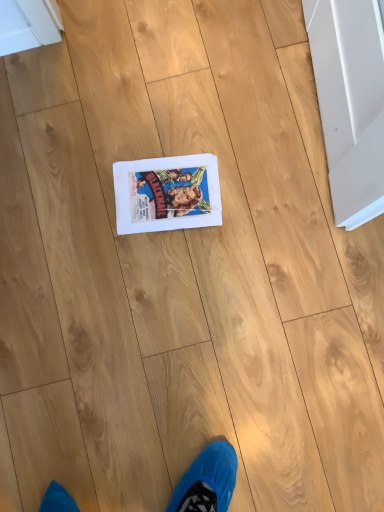
The height and width of the screenshot is (512, 384). Find the location of `empty space that is ontop of matte paper comic book at center`. empty space that is ontop of matte paper comic book at center is located at coordinates (167, 189).